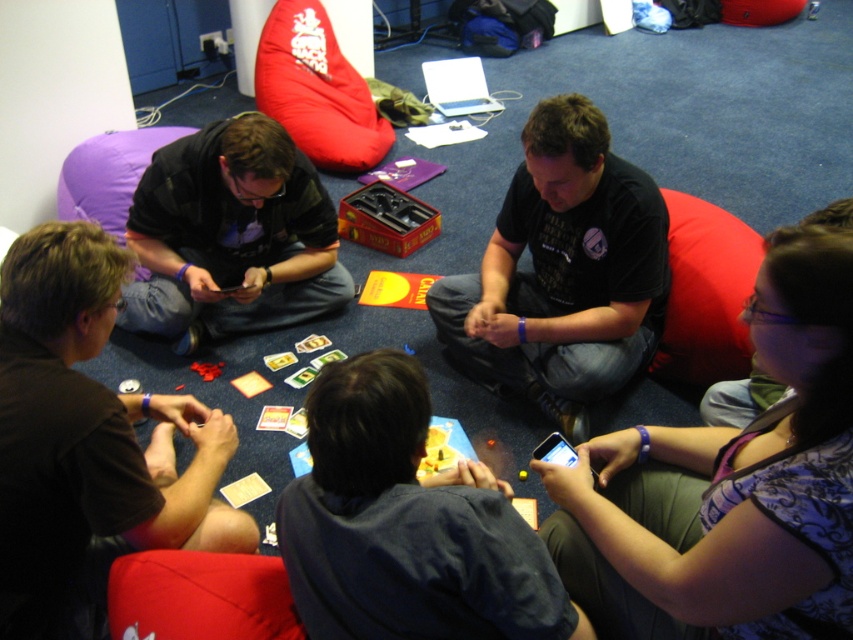
You are organizing a board game night and want to ensure everyone has enough space. You notice the brown matte shirt at lower left and the matte black shirt at left. Which participant has a smaller clothing item?

The brown matte shirt at lower left is smaller than the matte black shirt at left, so the participant wearing the brown matte shirt at lower left has the smaller clothing item.

You are part of the group playing the board game and want to pass a game piece from the person in the matte black shirt at left to the person in the black matte shirt at center. Which direction should you pass the piece?

The black matte shirt at center is to the right of the matte black shirt at left, so you should pass the piece to the right.

You are a photographer trying to capture a candid shot of the black matte shirt at center and the matte black shirt at left. Since you want to focus on the person at the center, which shirt should you position closer to the camera?

The black matte shirt at center is in front of the matte black shirt at left, so positioning the camera closer to the black matte shirt at center will ensure it is the main focus.